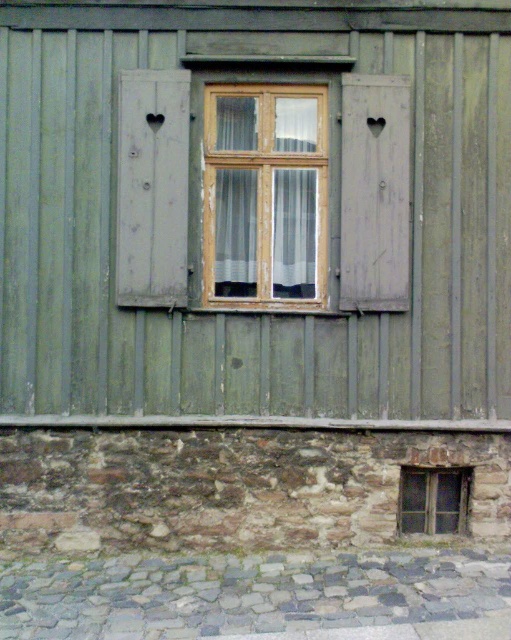
Question: Which object is positioned farthest from the wooden window at center?

Choices:
 (A) gray matte wooden shutter at right
 (B) wooden heart-shaped shutter at left

Answer: (B)

Question: Can you confirm if wooden heart-shaped shutter at left is smaller than gray matte wooden shutter at right?

Choices:
 (A) no
 (B) yes

Answer: (A)

Question: Which object is farther from the camera taking this photo?

Choices:
 (A) wooden window at center
 (B) gray matte wooden shutter at right
 (C) wooden heart-shaped shutter at left

Answer: (A)

Question: Does wooden heart-shaped shutter at left appear on the left side of transparent glass window at lower right?

Choices:
 (A) no
 (B) yes

Answer: (B)

Question: Does wooden window at center come in front of wooden heart-shaped shutter at left?

Choices:
 (A) no
 (B) yes

Answer: (A)

Question: Which point appears farthest from the camera in this image?

Choices:
 (A) 461,484
 (B) 350,122
 (C) 184,278

Answer: (A)